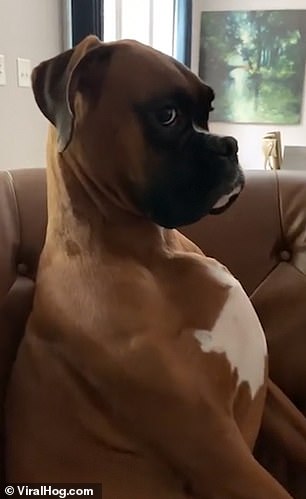
The image size is (306, 499). Find the location of `picture`. picture is located at coordinates tap(244, 46).